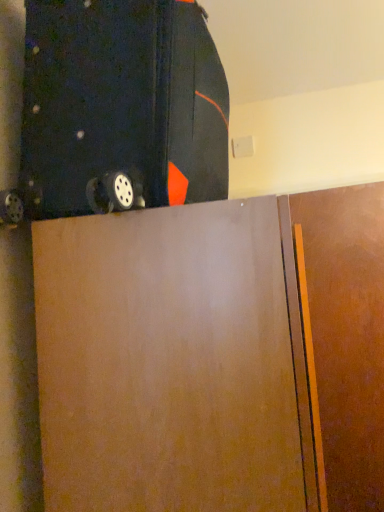
The width and height of the screenshot is (384, 512). What do you see at coordinates (119, 109) in the screenshot?
I see `matte black suitcase at upper left` at bounding box center [119, 109].

Locate an element on the screen. Image resolution: width=384 pixels, height=512 pixels. matte black suitcase at upper left is located at coordinates (119, 109).

Measure the distance between point (122, 75) and camera.

The depth of point (122, 75) is 29.13 inches.

The width and height of the screenshot is (384, 512). In order to click on matte black suitcase at upper left in this screenshot , I will do `click(119, 109)`.